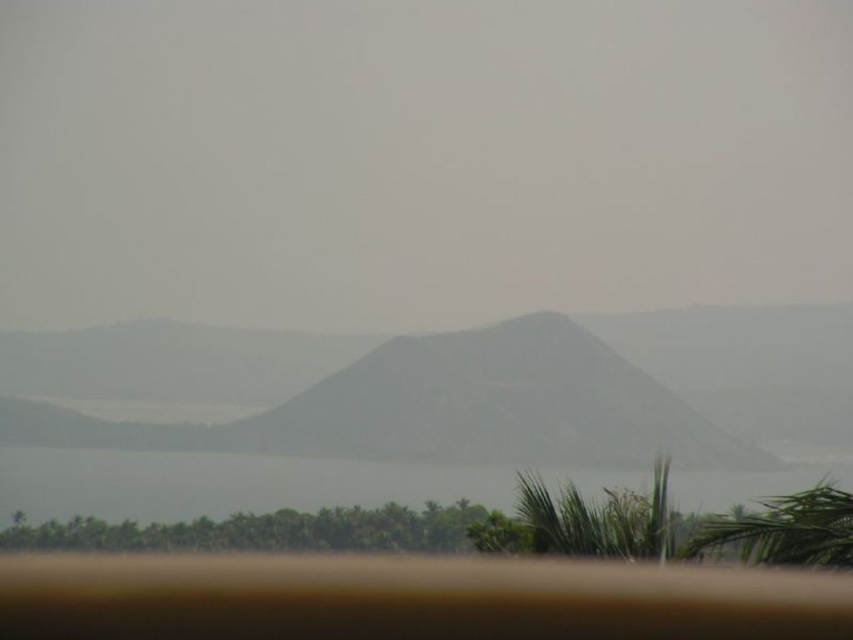
In the scene shown: You are a hiker planning to take a photo of the gray textured mountain at center and the transparent water at lower center. Based on their positions, which object will appear closer to the camera in your photo?

The transparent water at lower center appears closer to the camera because it is positioned lower in the image and is in the foreground compared to the gray textured mountain at center, which is further back.

You are a hiker planning to take a photo of the gray textured mountain at center and the transparent water at lower center. Based on the scene, where should you position yourself to ensure both objects are fully visible in your frame?

You should position yourself at a lower elevation so that the gray textured mountain at center remains above the transparent water at lower center, ensuring both are fully visible in your frame.

You are a hiker standing at the bottom of the gray textured mountain at center. What are the coordinates of the mountain?

The coordinates of the gray textured mountain at center are point (450, 388).